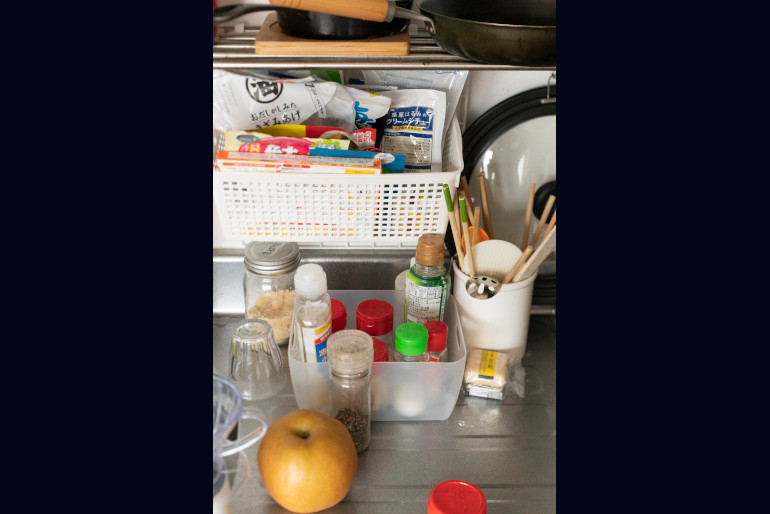
The image size is (770, 514). I want to click on white plastic basket, so click(x=327, y=198).